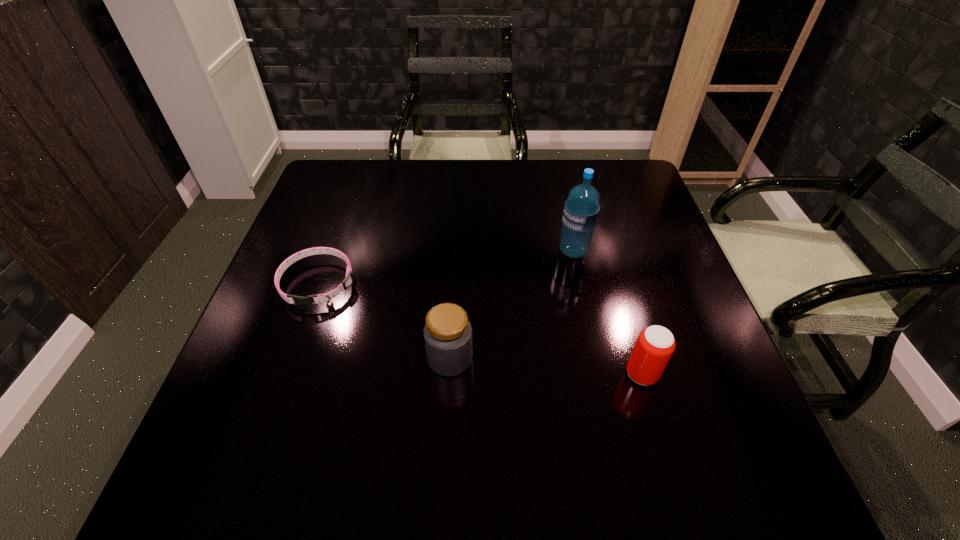
This screenshot has width=960, height=540. What are the coordinates of `unoccupied area between the second object from left to right and the rightmost object` in the screenshot? It's located at (546, 366).

I want to click on free spot between the dog collar and the third object from right to left, so click(384, 321).

Locate an element on the screen. empty location between the shortest object and the tallest object is located at coordinates (445, 267).

I want to click on free spot between the rightmost object and the dog collar, so click(x=480, y=329).

This screenshot has height=540, width=960. I want to click on free spot between the leftmost object and the beer can, so click(x=480, y=329).

You are a GUI agent. You are given a task and a screenshot of the screen. Output one action in this format:
    pyautogui.click(x=<x>, y=<y>)
    Task: Click on the vacant space that's between the second object from left to right and the tallest object
    
    Given the screenshot: What is the action you would take?
    pyautogui.click(x=512, y=305)

Where is `vacant region between the rightmost object and the jar`? vacant region between the rightmost object and the jar is located at coordinates (546, 366).

The width and height of the screenshot is (960, 540). In order to click on unoccupied position between the rightmost object and the leftmost object in this screenshot , I will do `click(480, 329)`.

Locate an element on the screen. This screenshot has width=960, height=540. vacant point located between the third object from right to left and the tallest object is located at coordinates (512, 305).

At what (x,y) coordinates should I click in order to perform the action: click on free space between the beer can and the third object from left to right. Please return your answer as a coordinate pair (x, y). The image size is (960, 540). Looking at the image, I should click on (608, 313).